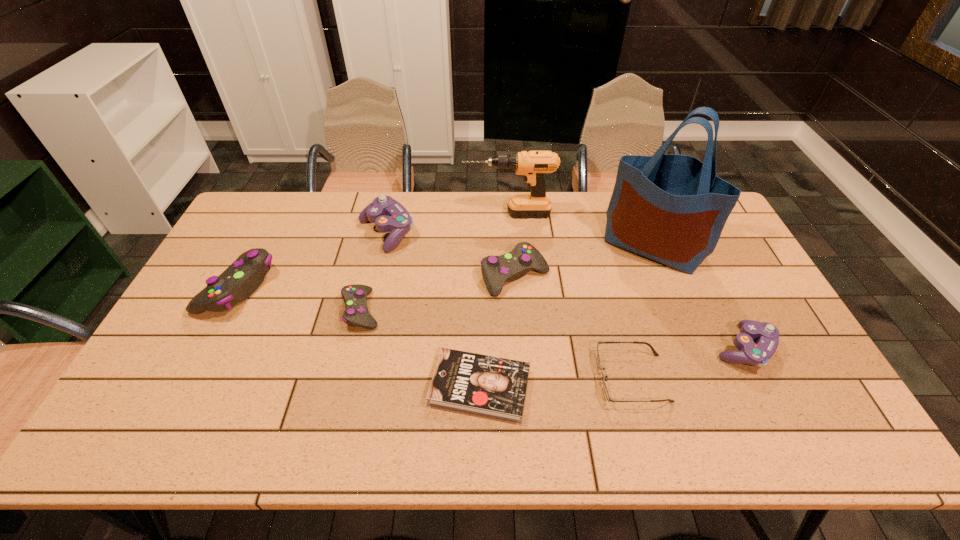
Locate an element on the screen. vacant region between the eighth shortest object and the spectacles is located at coordinates (570, 296).

Locate an element on the screen. free spot between the smaller purple control and the leftmost control is located at coordinates (491, 317).

I want to click on free spot between the second gray control from left to right and the rightmost control, so click(x=552, y=329).

You are a GUI agent. You are given a task and a screenshot of the screen. Output one action in this format:
    pyautogui.click(x=<x>, y=<y>)
    Task: Click on the vacant space that is in between the left purple control and the drill
    Image resolution: width=960 pixels, height=540 pixels.
    Given the screenshot: What is the action you would take?
    pyautogui.click(x=447, y=224)

Identify the location of free area in between the book and the rightmost control. This screenshot has height=540, width=960. (612, 368).

At what (x,y) coordinates should I click in order to perform the action: click on empty space that is in between the second smallest gray control and the second tallest object. Please return your answer as a coordinate pair (x, y). Looking at the image, I should click on (512, 245).

What are the coordinates of `free point between the leftmost gray control and the rightmost control` in the screenshot? It's located at (491, 317).

Find the location of `free space between the left purple control and the smallest gray control`. free space between the left purple control and the smallest gray control is located at coordinates (373, 271).

The width and height of the screenshot is (960, 540). Identify the location of vacant space that's between the smallest gray control and the bigger purple control. (373, 271).

Locate an element on the screen. The height and width of the screenshot is (540, 960). vacant space that's between the tallest object and the spectacles is located at coordinates (642, 312).